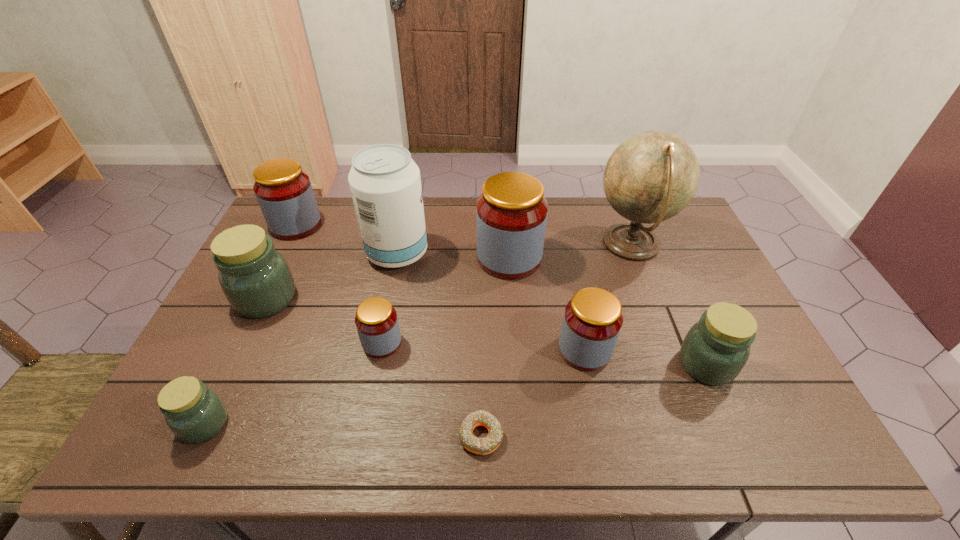
What are the coordinates of `free region located 0.390m on the front of the third red jar from left to right` in the screenshot? It's located at (518, 392).

The width and height of the screenshot is (960, 540). What are the coordinates of `vacant area located 0.230m on the right of the leftmost red jar` in the screenshot? It's located at coord(386,225).

The image size is (960, 540). Identify the location of free location located on the front of the biggest green jar. (243, 348).

What are the coordinates of `free space located 0.090m on the left of the rightmost jar` in the screenshot? It's located at (643, 364).

The height and width of the screenshot is (540, 960). In order to click on free space located on the back of the sixth jar from left to right in this screenshot , I will do `click(573, 295)`.

Where is `free location located on the left of the second red jar from left to right`? This screenshot has height=540, width=960. free location located on the left of the second red jar from left to right is located at coordinates (292, 343).

Identify the location of vacant region located on the right of the smallest green jar. Image resolution: width=960 pixels, height=540 pixels. (315, 424).

Image resolution: width=960 pixels, height=540 pixels. Find the location of `free space located 0.270m on the right of the chocolate doughnut`. free space located 0.270m on the right of the chocolate doughnut is located at coordinates (623, 436).

Locate an element on the screen. The image size is (960, 540). globe that is at the far edge is located at coordinates (652, 176).

Find the location of `alcohol that is at the far edge`. alcohol that is at the far edge is located at coordinates (385, 183).